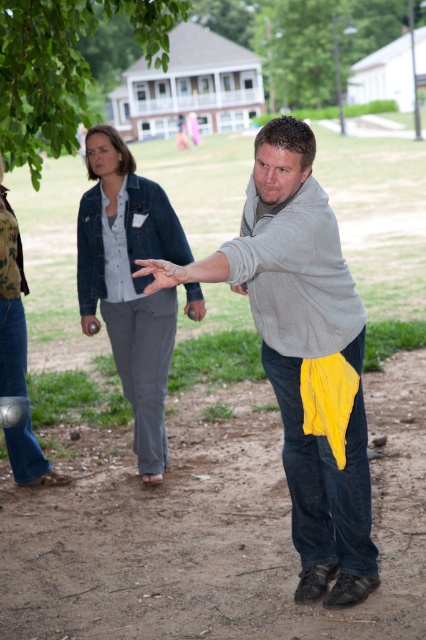
Question: Among these points, which one is nearest to the camera?

Choices:
 (A) click(123, 225)
 (B) click(132, 240)
 (C) click(271, 339)
 (D) click(336, 248)

Answer: (D)

Question: Based on their relative distances, which object is nearer to the denim jacket at upper left?

Choices:
 (A) gray fleece sweatshirt at center
 (B) green leafy tree at upper left
 (C) denim pants at center
 (D) denim jacket at upper center

Answer: (D)

Question: Which of these objects is positioned closest to the denim pants at center?

Choices:
 (A) denim jacket at upper left
 (B) gray fleece sweatshirt at center

Answer: (A)

Question: In this image, where is gray cotton sweater at center located relative to green leafy tree at upper left?

Choices:
 (A) right
 (B) left

Answer: (A)

Question: Observing the image, what is the correct spatial positioning of gray fleece sweatshirt at center in reference to denim pants at center?

Choices:
 (A) above
 (B) below

Answer: (A)

Question: Is gray cotton sweater at center thinner than denim jacket at upper center?

Choices:
 (A) yes
 (B) no

Answer: (B)